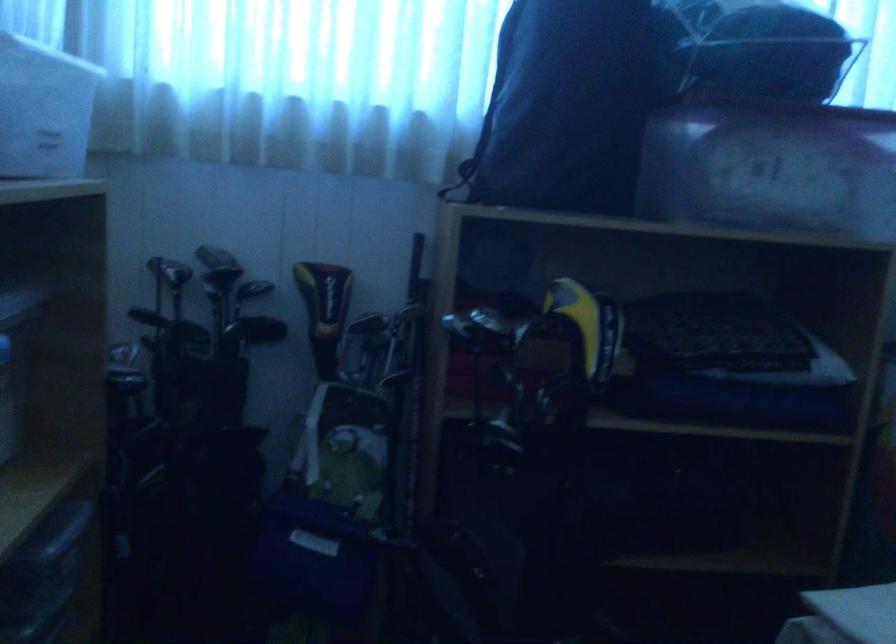
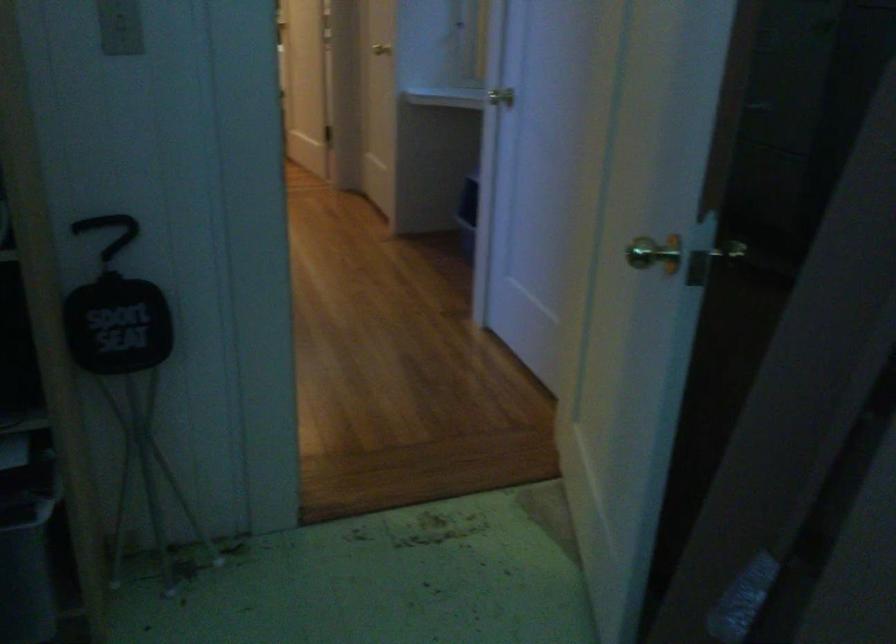
The images are taken continuously from a first-person perspective. In which direction is your viewpoint rotating?

The rotation direction of the camera is right-down.